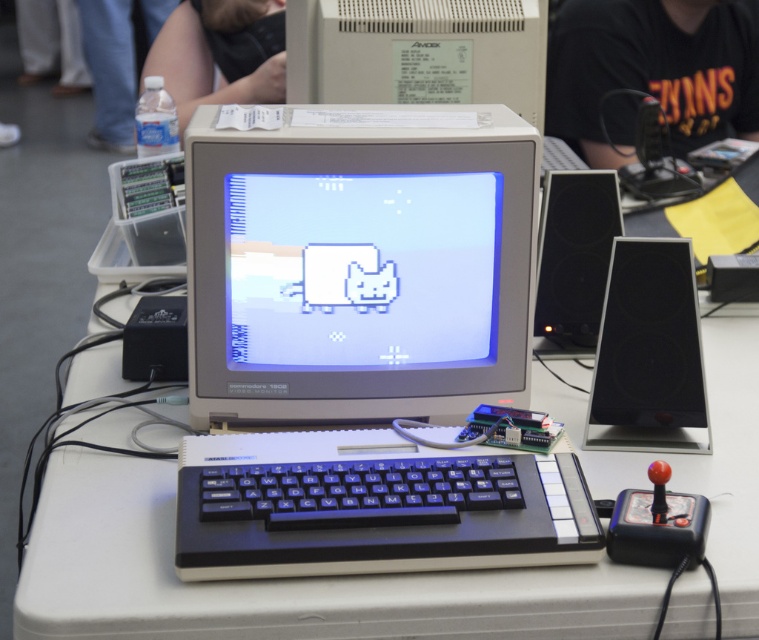
Question: Which of the following is the closest to the observer?

Choices:
 (A) (372, 256)
 (B) (569, 515)

Answer: (B)

Question: Which is farther from the black plastic keyboard at center?

Choices:
 (A) matte gray monitor at center
 (B) white plastic computer monitor at upper center

Answer: (B)

Question: Can you confirm if matte gray monitor at center is positioned to the left of white plastic computer monitor at upper center?

Choices:
 (A) yes
 (B) no

Answer: (A)

Question: From the image, what is the correct spatial relationship of black plastic keyboard at center in relation to white plastic computer monitor at upper center?

Choices:
 (A) above
 (B) below

Answer: (B)

Question: Considering the real-world distances, which object is closest to the white plastic computer monitor at upper center?

Choices:
 (A) matte gray monitor at center
 (B) black plastic keyboard at center

Answer: (A)

Question: Is black plastic keyboard at center smaller than white plastic computer monitor at upper center?

Choices:
 (A) yes
 (B) no

Answer: (A)